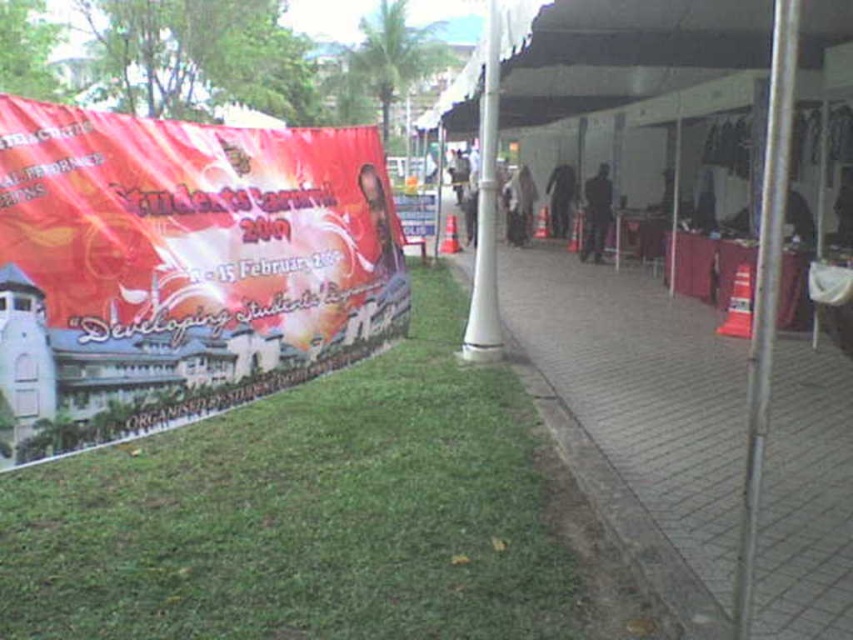
Question: Is brick paved sidewalk at center to the right of white fabric canopy at upper center from the viewer's perspective?

Choices:
 (A) no
 (B) yes

Answer: (B)

Question: Which point appears farthest from the camera in this image?

Choices:
 (A) (672, 51)
 (B) (495, 80)
 (C) (838, 611)

Answer: (A)

Question: Is white fabric canopy at upper center further to camera compared to white plastic pole at center?

Choices:
 (A) no
 (B) yes

Answer: (A)

Question: In this image, where is white fabric canopy at upper center located relative to white plastic pole at center?

Choices:
 (A) right
 (B) left

Answer: (A)

Question: Which object is positioned farthest from the brick paved sidewalk at center?

Choices:
 (A) white plastic pole at center
 (B) white fabric canopy at upper center
 (C) metallic pole at center

Answer: (C)

Question: Which of the following is the closest to the observer?

Choices:
 (A) white plastic pole at center
 (B) brick paved sidewalk at center
 (C) green grass at lower left
 (D) white fabric canopy at upper center

Answer: (B)